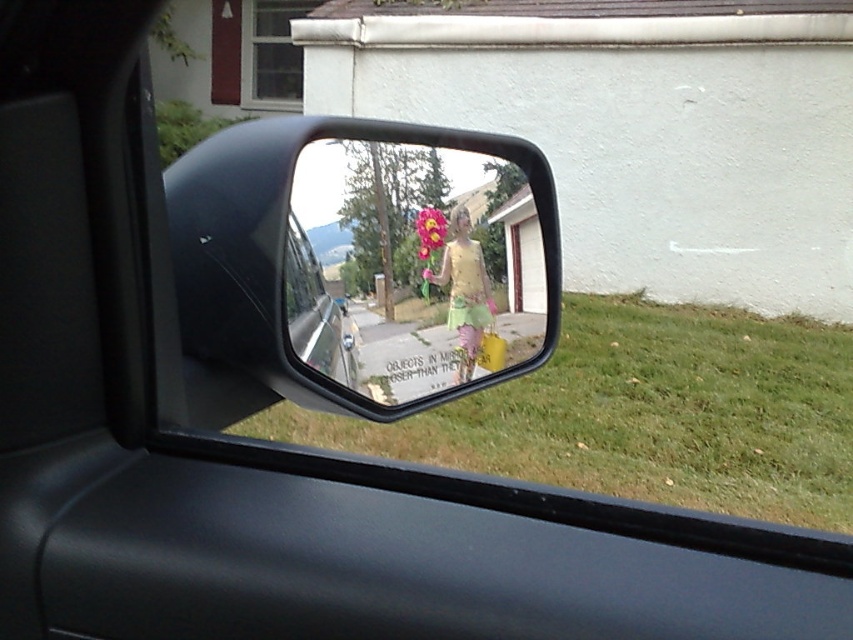
Question: Is matte yellow flower at center smaller than fluffy pink flower at center?

Choices:
 (A) yes
 (B) no

Answer: (B)

Question: Which of the following is the farthest from the observer?

Choices:
 (A) fluffy pink flower at center
 (B) matte yellow flower at center

Answer: (A)

Question: Is matte yellow flower at center wider than fluffy pink flower at center?

Choices:
 (A) yes
 (B) no

Answer: (A)

Question: Is matte yellow flower at center to the left of fluffy pink flower at center from the viewer's perspective?

Choices:
 (A) yes
 (B) no

Answer: (B)

Question: Which point is closer to the camera?

Choices:
 (A) fluffy pink flower at center
 (B) matte yellow flower at center

Answer: (B)

Question: Among these points, which one is farthest from the camera?

Choices:
 (A) (426, 257)
 (B) (485, 243)

Answer: (B)